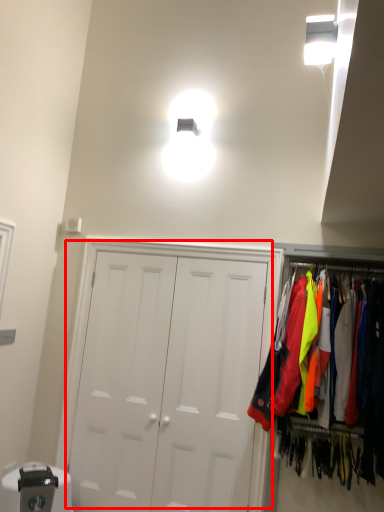
Question: In this image, where is door (annotated by the red box) located relative to closet?

Choices:
 (A) left
 (B) right

Answer: (A)